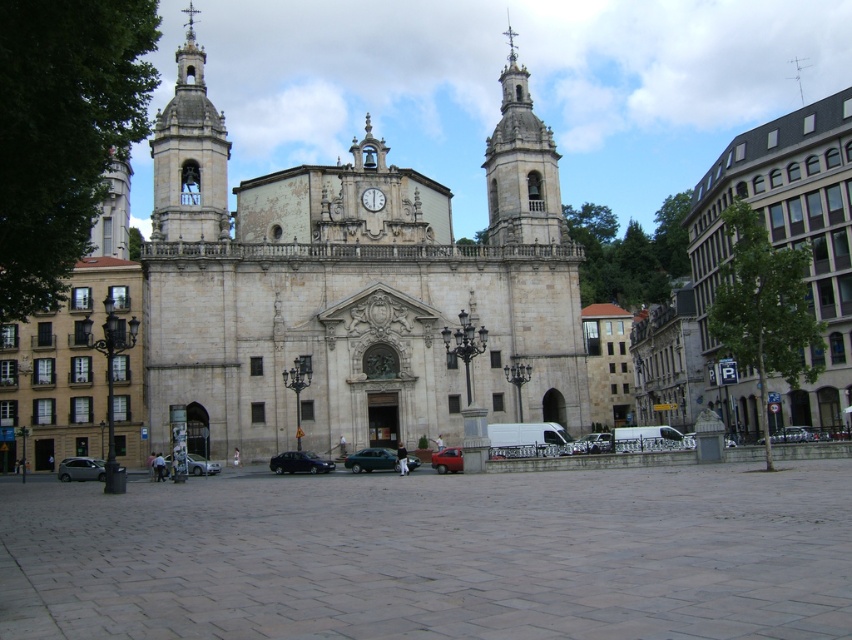
Consider the image. You are a delivery driver who needs to park your 5.5 meter long truck between the metallic green car at center and the metallic gray car at lower left. Is there enough space between them to park your truck?

The distance between the metallic green car at center and the metallic gray car at lower left is 25.98 meters, which is more than enough to park a 5.5 meter long truck between them.